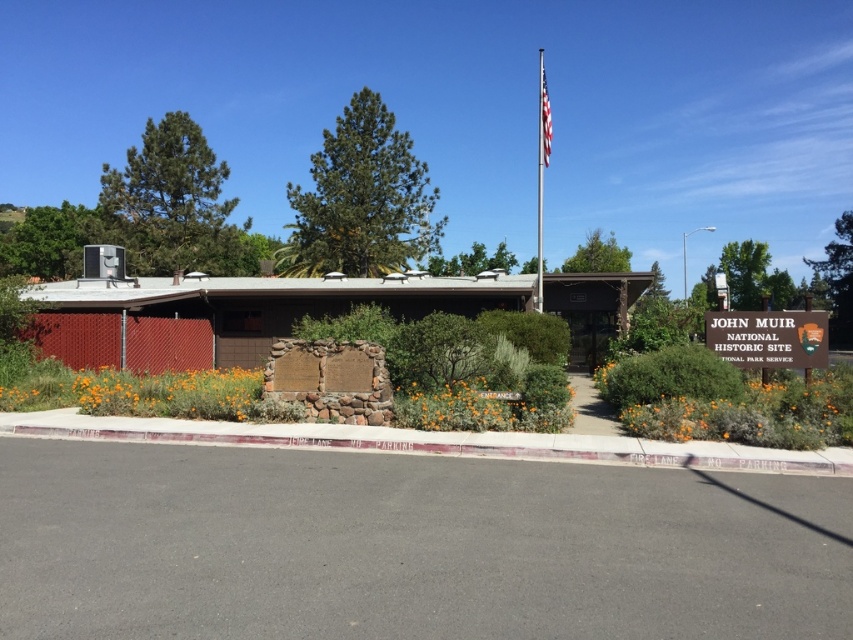
You are planning to take a photo of the green wooden sign at center and the american flag at upper center from a single position. Considering the distance between them, will you be able to frame both in the same shot without moving your camera position?

The distance between the green wooden sign at center and the american flag at upper center is 129.48 feet. Depending on the camera lens used, capturing both in the same frame may require a wide angle lens to accommodate the distance between them.

You are a visitor at the John Muir National Historic Site entrance. You see a green wooden sign at center and a polished metal flag pole at upper center. Which object takes up more area in the image?

The polished metal flag pole at upper center takes up more area in the image than the green wooden sign at center because the green wooden sign at center occupies less space than polished metal flag pole at upper center.